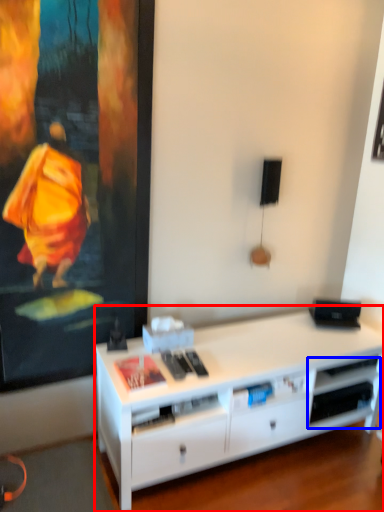
Question: Which object is closer to the camera taking this photo, desk (highlighted by a red box) or shelf (highlighted by a blue box)?

Choices:
 (A) desk
 (B) shelf

Answer: (A)